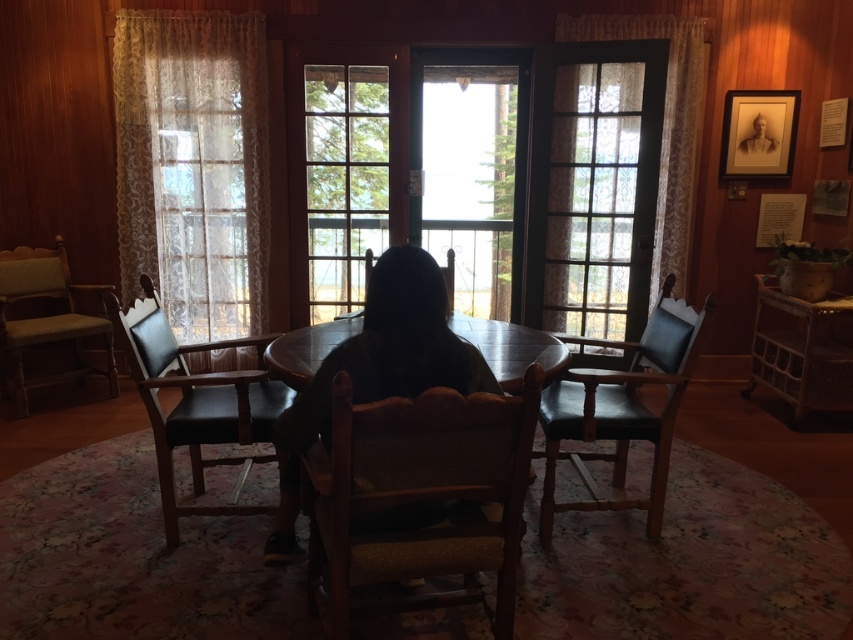
You are standing in the dining area and want to exit through the clear glass door at center. Which direction should you move relative to the wooden armchair at left to reach it?

The clear glass door at center is to the right of the wooden armchair at left, so you should move to the right side of the wooden armchair at left to reach it.